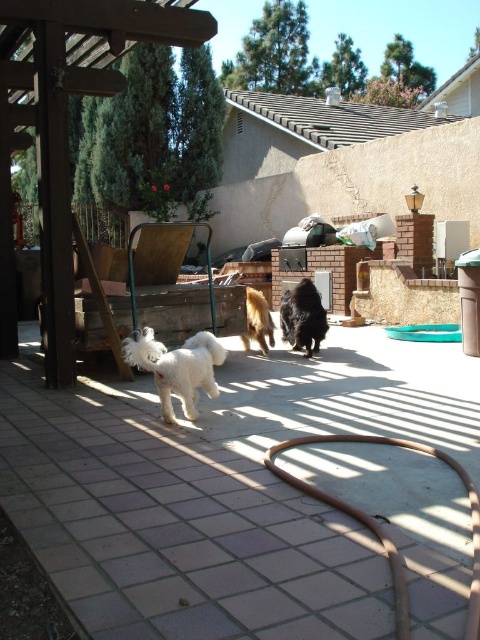
Between white fluffy dog at center and black fuzzy dog at center, which one has less height?

Standing shorter between the two is white fluffy dog at center.

Does point (180, 387) lie behind point (317, 332)?

No, it is in front of (317, 332).

Does point (201, 360) lie in front of point (280, 310)?

Yes, it is.

Identify the location of white fluffy dog at center. This screenshot has width=480, height=640. click(x=178, y=368).

Does black fuzzy dog at center have a greater width compared to golden fur dog at center?

Yes.

Measure the distance between black fuzzy dog at center and camera.

17.90 feet

Locate an element on the screen. The height and width of the screenshot is (640, 480). black fuzzy dog at center is located at coordinates (302, 317).

Is white fluffy dog at center above golden fur dog at center?

Incorrect, white fluffy dog at center is not positioned above golden fur dog at center.

Is point (140, 364) positioned before point (261, 323)?

Yes, point (140, 364) is closer to viewer.

At what (x,y) coordinates should I click in order to perform the action: click on white fluffy dog at center. Please return your answer as a coordinate pair (x, y). Looking at the image, I should click on (178, 368).